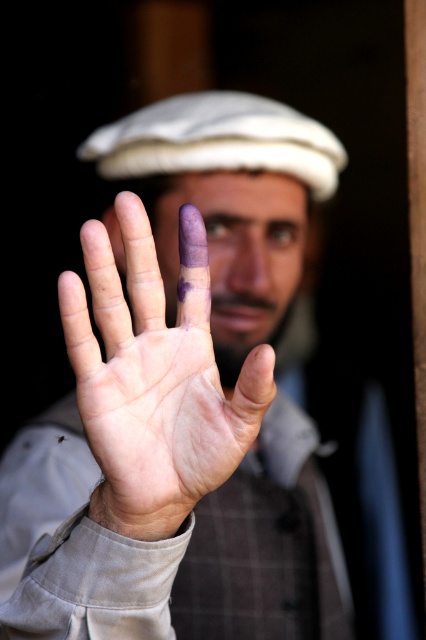
Is purple matte hand at center smaller than purple matte palm at center?

Incorrect, purple matte hand at center is not smaller in size than purple matte palm at center.

Looking at this image, does purple matte hand at center appear over purple matte palm at center?

Incorrect, purple matte hand at center is not positioned above purple matte palm at center.

Identify the location of purple matte hand at center. This screenshot has height=640, width=426. (181, 397).